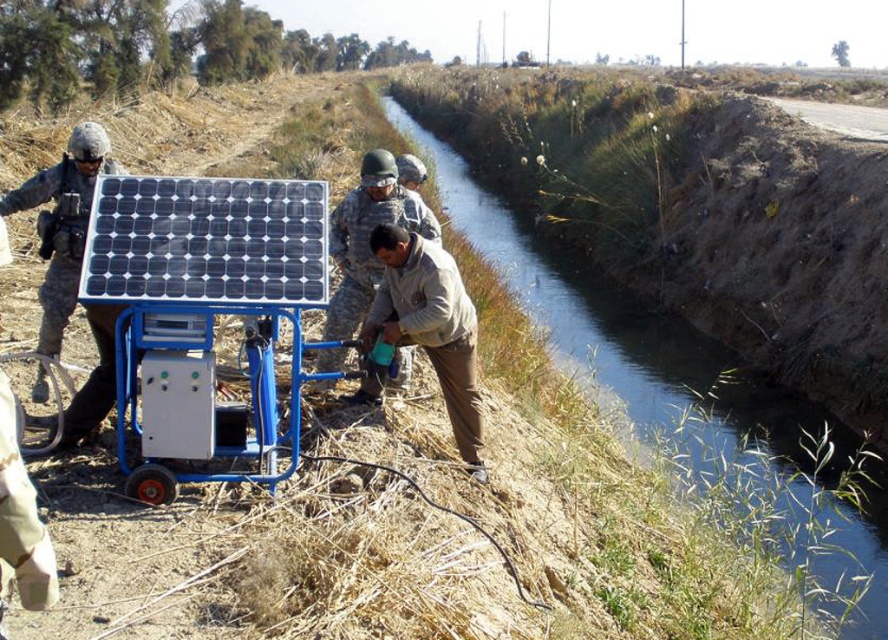
Question: Can you confirm if camouflage uniform at center is wider than matte black helmet at left?

Choices:
 (A) no
 (B) yes

Answer: (B)

Question: Which point appears closest to the camera in this image?

Choices:
 (A) coord(466,419)
 (B) coord(536,285)

Answer: (A)

Question: Which point is closer to the camera taking this photo?

Choices:
 (A) (526, 241)
 (B) (338, 252)

Answer: (B)

Question: Is green grassy bank at center wider than camouflage uniform at center?

Choices:
 (A) no
 (B) yes

Answer: (B)

Question: Which object is the closest to the brown cotton shirt at center?

Choices:
 (A) camouflage uniform at center
 (B) green grassy bank at center
 (C) matte black helmet at left

Answer: (A)

Question: In this image, where is brown cotton shirt at center located relative to matte black helmet at left?

Choices:
 (A) right
 (B) left

Answer: (A)